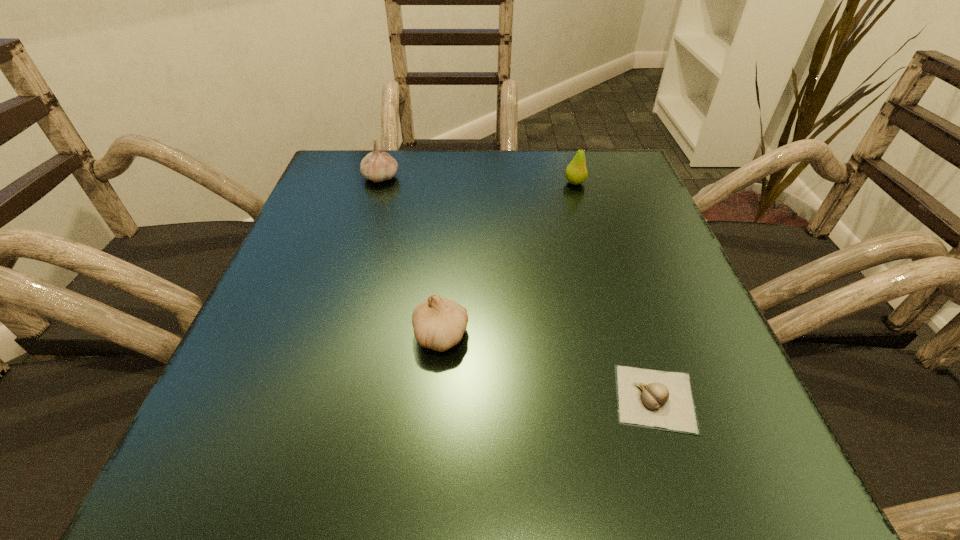
In order to click on blank area in the image that satisfies the following two spatial constraints: 1. on the front side of the farthest garlic; 2. on the right side of the shortest garlic in this screenshot , I will do `click(313, 399)`.

Identify the location of vacant space that satisfies the following two spatial constraints: 1. on the back side of the second nearest garlic; 2. on the left side of the pear. The width and height of the screenshot is (960, 540). (453, 183).